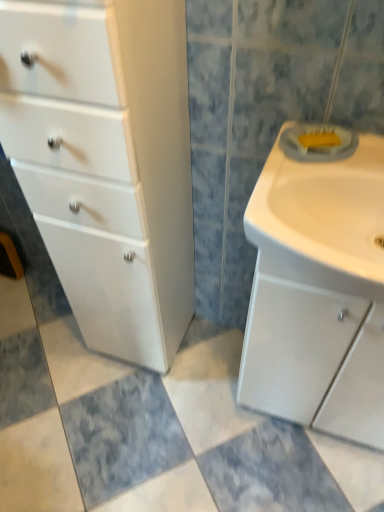
Identify the location of vacant region in front of white glossy cabinet at left. The image size is (384, 512). (139, 413).